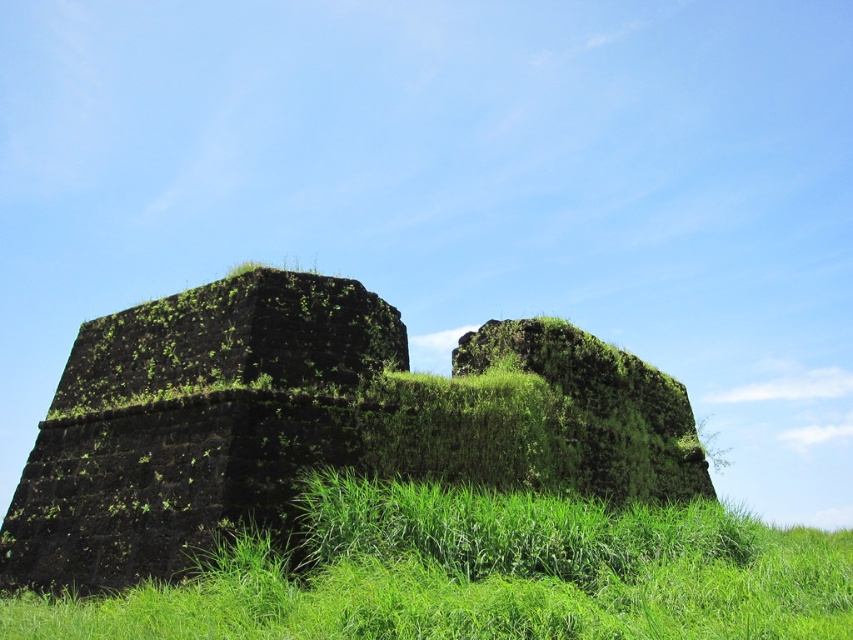
You are an archaeologist examining the ancient site. You need to determine which object is taller between the green mossy stone wall at center and the green grassy at lower center. Based on the scene, which one is taller?

The green mossy stone wall at center is taller than the green grassy at lower center.

From the picture: You are standing in the middle of the image and want to walk towards the green mossy stone wall at center. Which direction should you move to reach it?

Since the green mossy stone wall at center is located at coordinates approximately 0.661 on the x axis and 0.369 on the y axis, you should move towards the right and slightly downward from the center to reach it.

You are a landscape architect planning to install a new pathway between the green mossy stone wall at center and the green grassy at lower center. Which object has a greater width, and would this affect the pathway design?

The green mossy stone wall at center has a greater width than the green grassy at lower center. This difference in width should be considered when designing the pathway to ensure proper alignment and spacing between the two areas.